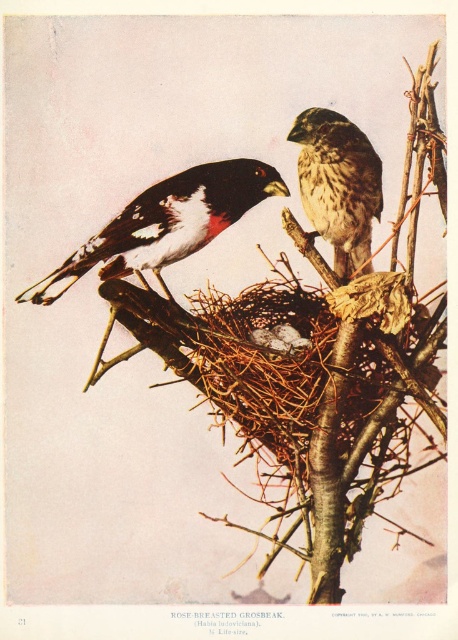
Is point (206, 333) closer to camera compared to point (352, 253)?

Yes, it is in front of point (352, 253).

Between brown twigs at center and brown speckled feathers at upper center, which one appears on the right side from the viewer's perspective?

Positioned to the right is brown speckled feathers at upper center.

Is point (120, 301) closer to viewer compared to point (355, 262)?

Yes.

The width and height of the screenshot is (458, 640). Find the location of `brown twigs at center`. brown twigs at center is located at coordinates (316, 368).

I want to click on brown twigs at center, so click(x=316, y=368).

Find the location of a particular element. The image size is (458, 640). brown twigs at center is located at coordinates (316, 368).

How much distance is there between black and white speckled bird at center and brown speckled feathers at upper center?

A distance of 8.00 inches exists between black and white speckled bird at center and brown speckled feathers at upper center.

Which is behind, point (27, 289) or point (359, 193)?

Point (359, 193)

At what (x,y) coordinates should I click in order to perform the action: click on black and white speckled bird at center. Please return your answer as a coordinate pair (x, y). The width and height of the screenshot is (458, 640). Looking at the image, I should click on (169, 221).